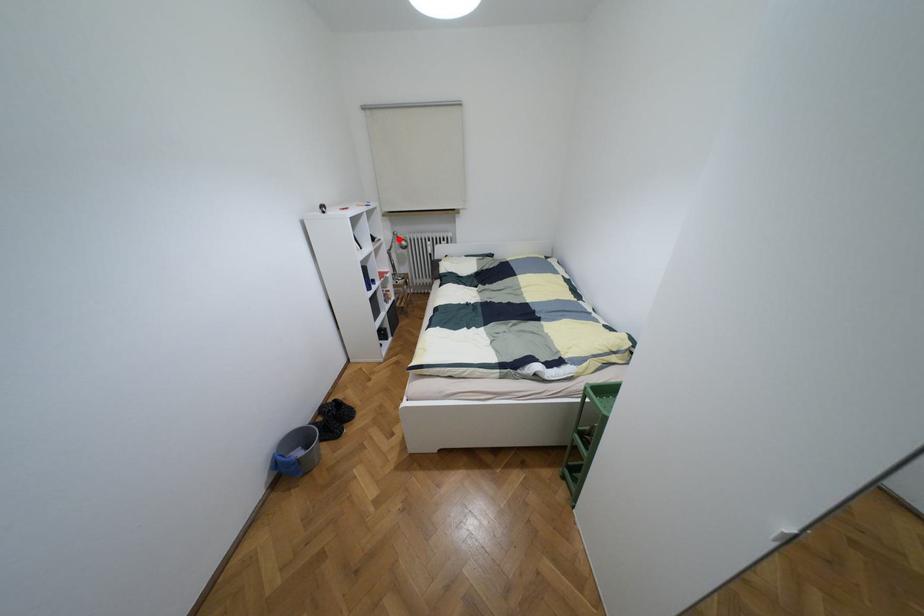
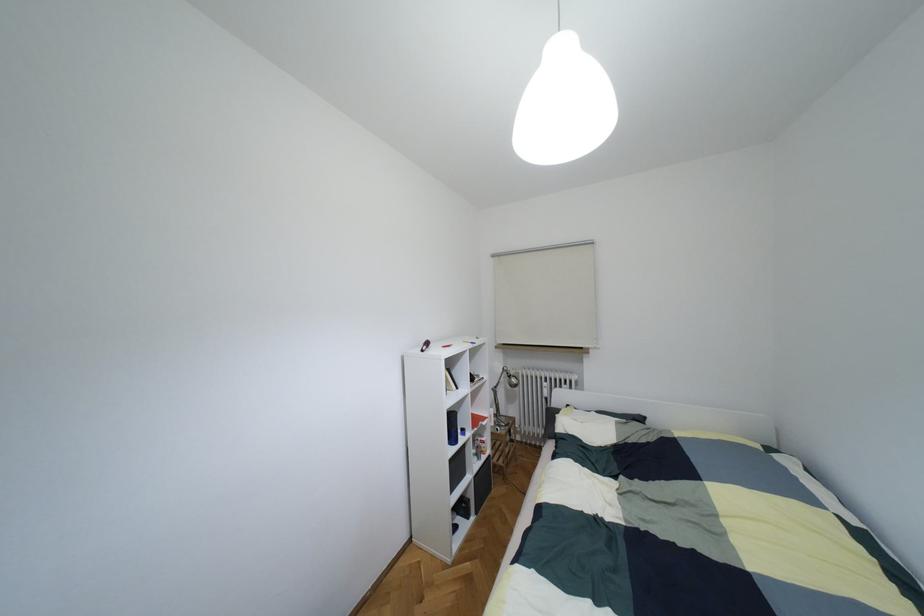
Question: I am providing you with two images of the same scene from different viewpoints. A red point is marked on the first image. Is the red point's position out of view in image 2?

Choices:
 (A) Yes
 (B) No

Answer: (B)